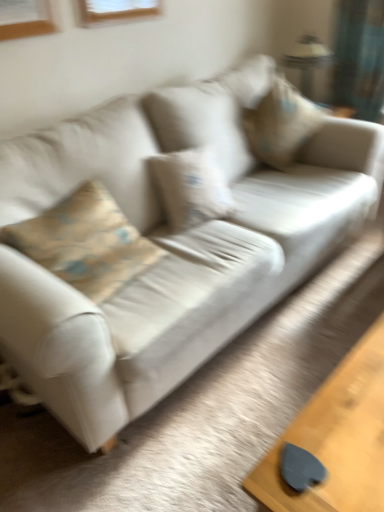
The width and height of the screenshot is (384, 512). What are the coordinates of `vacant area on top of smooth wooden table at lower right (from a real-world perspective)` in the screenshot? It's located at (350, 428).